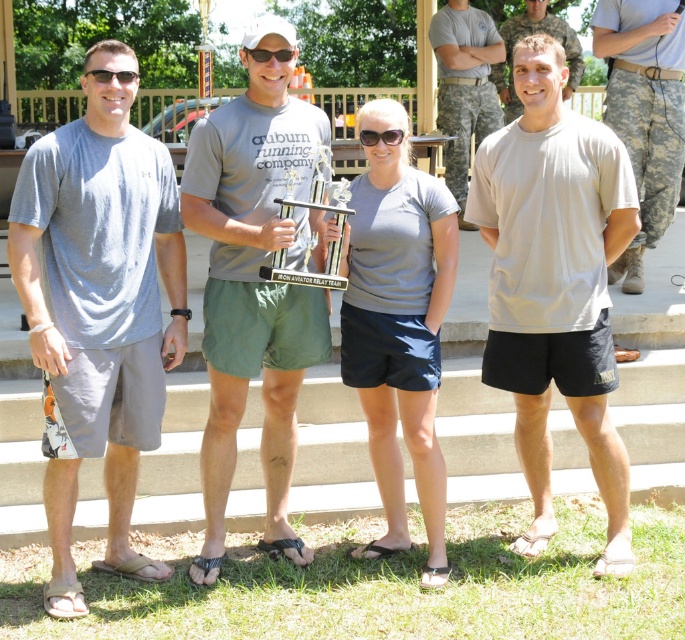
Question: In this image, where is gray fabric t-shirt at left located relative to transparent plastic goggles at center?

Choices:
 (A) above
 (B) below

Answer: (B)

Question: Considering the relative positions of beige cotton t-shirt at center and camouflage uniform at right in the image provided, where is beige cotton t-shirt at center located with respect to camouflage uniform at right?

Choices:
 (A) left
 (B) right

Answer: (A)

Question: Is beige cotton t-shirt at center further to camera compared to transparent plastic goggles at center?

Choices:
 (A) no
 (B) yes

Answer: (A)

Question: Which object appears farthest from the camera in this image?

Choices:
 (A) gray fabric t-shirt at left
 (B) beige cotton t-shirt at center
 (C) camouflage pants at center

Answer: (C)

Question: Which point appears closest to the camera in this image?

Choices:
 (A) (540, 145)
 (B) (132, 77)

Answer: (B)

Question: Which point is closer to the camera taking this photo?

Choices:
 (A) (525, 444)
 (B) (680, 80)

Answer: (A)